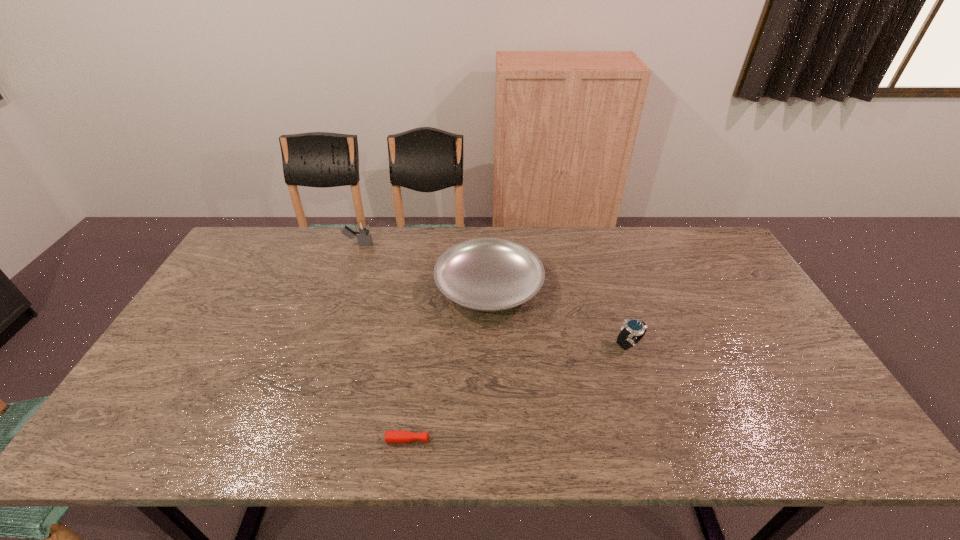
The height and width of the screenshot is (540, 960). In order to click on free space located at the tip of the shortest object in this screenshot , I will do `click(588, 440)`.

At what (x,y) coordinates should I click in order to perform the action: click on igniter located at the far edge. Please return your answer as a coordinate pair (x, y). The image size is (960, 540). Looking at the image, I should click on (364, 237).

I want to click on bedpan that is at the far edge, so click(486, 274).

Where is `object that is at the near edge`? object that is at the near edge is located at coordinates (400, 436).

This screenshot has width=960, height=540. I want to click on free region at the far edge, so click(x=434, y=258).

Where is `vacant space at the near edge of the desktop`? vacant space at the near edge of the desktop is located at coordinates (644, 434).

The width and height of the screenshot is (960, 540). In order to click on vacant region at the left edge of the desktop in this screenshot , I will do `click(213, 295)`.

Identify the location of vacant space at the right edge. (797, 401).

At what (x,y) coordinates should I click in order to perform the action: click on vacant space at the far left corner of the desktop. Please return your answer as a coordinate pair (x, y). Looking at the image, I should click on (272, 228).

Image resolution: width=960 pixels, height=540 pixels. In the image, there is a desktop. Identify the location of vacant region at the far right corner. (x=698, y=267).